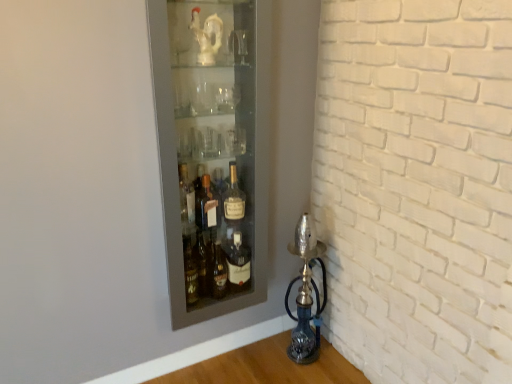
Question: Is matte glass cabinet at upper left outside of blue glass oil lamp at lower right?

Choices:
 (A) yes
 (B) no

Answer: (A)

Question: Is matte glass cabinet at upper left wider than blue glass oil lamp at lower right?

Choices:
 (A) no
 (B) yes

Answer: (A)

Question: Is blue glass oil lamp at lower right a part of matte glass cabinet at upper left?

Choices:
 (A) no
 (B) yes

Answer: (A)

Question: Is matte glass cabinet at upper left not close to blue glass oil lamp at lower right?

Choices:
 (A) yes
 (B) no

Answer: (B)

Question: From the image's perspective, is matte glass cabinet at upper left beneath blue glass oil lamp at lower right?

Choices:
 (A) no
 (B) yes

Answer: (A)

Question: Considering the relative sizes of matte glass cabinet at upper left and blue glass oil lamp at lower right in the image provided, is matte glass cabinet at upper left smaller than blue glass oil lamp at lower right?

Choices:
 (A) yes
 (B) no

Answer: (B)

Question: Is blue glass oil lamp at lower right in front of matte glass bottle at center?

Choices:
 (A) no
 (B) yes

Answer: (A)

Question: Can you confirm if blue glass oil lamp at lower right is thinner than matte glass bottle at center?

Choices:
 (A) yes
 (B) no

Answer: (B)

Question: Is there a large distance between blue glass oil lamp at lower right and matte glass bottle at center?

Choices:
 (A) no
 (B) yes

Answer: (A)

Question: From the image's perspective, is blue glass oil lamp at lower right beneath matte glass bottle at center?

Choices:
 (A) yes
 (B) no

Answer: (A)

Question: Considering the relative sizes of blue glass oil lamp at lower right and matte glass bottle at center in the image provided, is blue glass oil lamp at lower right smaller than matte glass bottle at center?

Choices:
 (A) no
 (B) yes

Answer: (A)

Question: Can you confirm if blue glass oil lamp at lower right is bigger than matte glass bottle at center?

Choices:
 (A) no
 (B) yes

Answer: (B)

Question: From a real-world perspective, does matte glass bottle at center stand above matte glass cabinet at upper left?

Choices:
 (A) yes
 (B) no

Answer: (B)